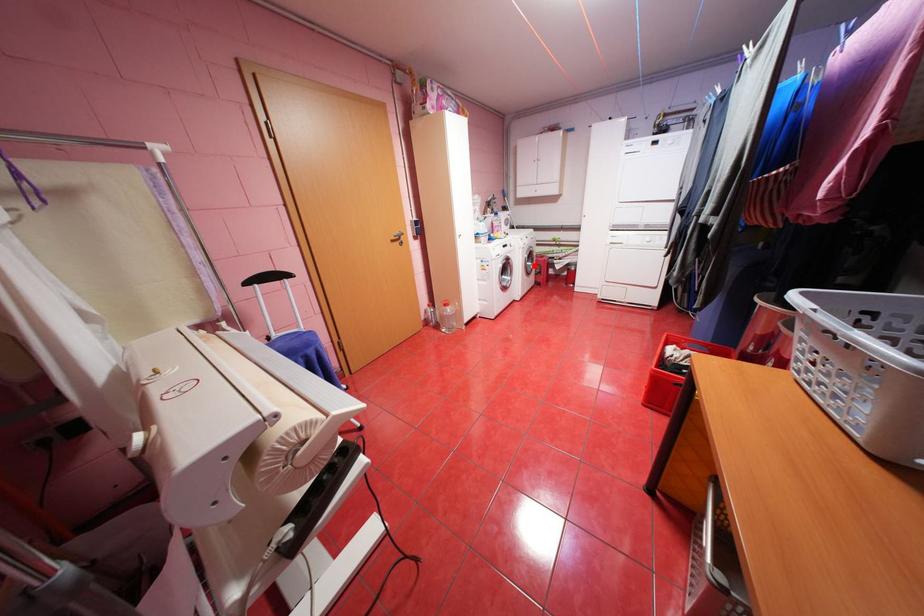
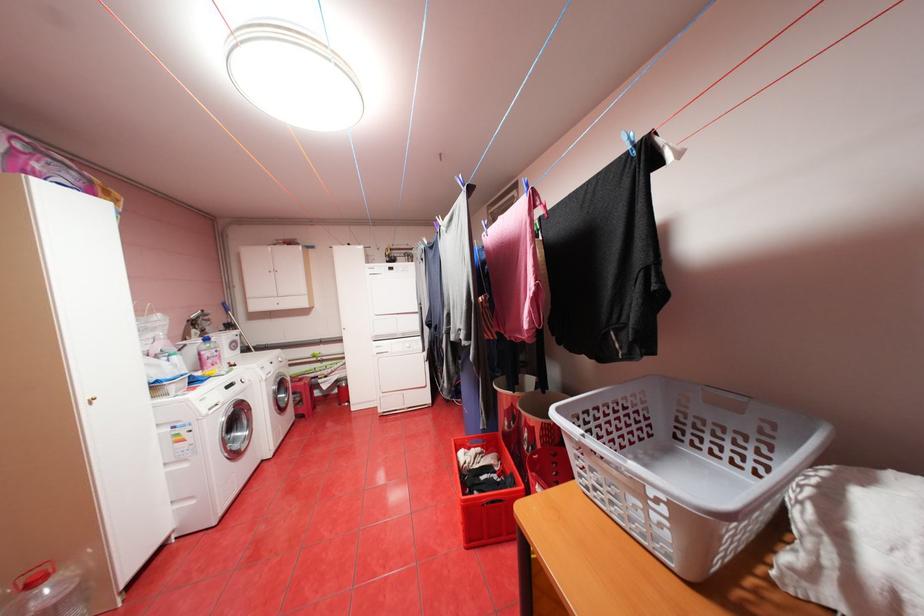
Question: I am providing you with two images of the same scene from different viewpoints. Given a red point in image1, look at the same physical point in image2. Is it:

Choices:
 (A) Closer to the viewpoint
 (B) Farther from the viewpoint

Answer: (A)